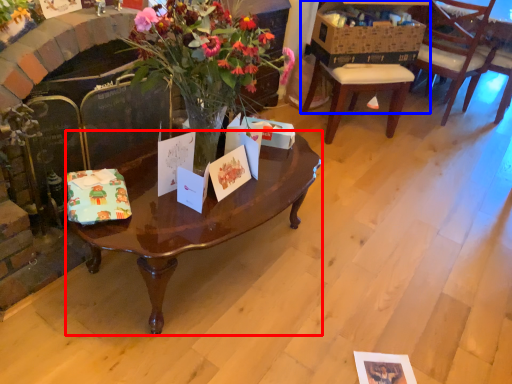
Question: Which point is closer to the camera, coffee table (highlighted by a red box) or desk (highlighted by a blue box)?

Choices:
 (A) coffee table
 (B) desk

Answer: (A)